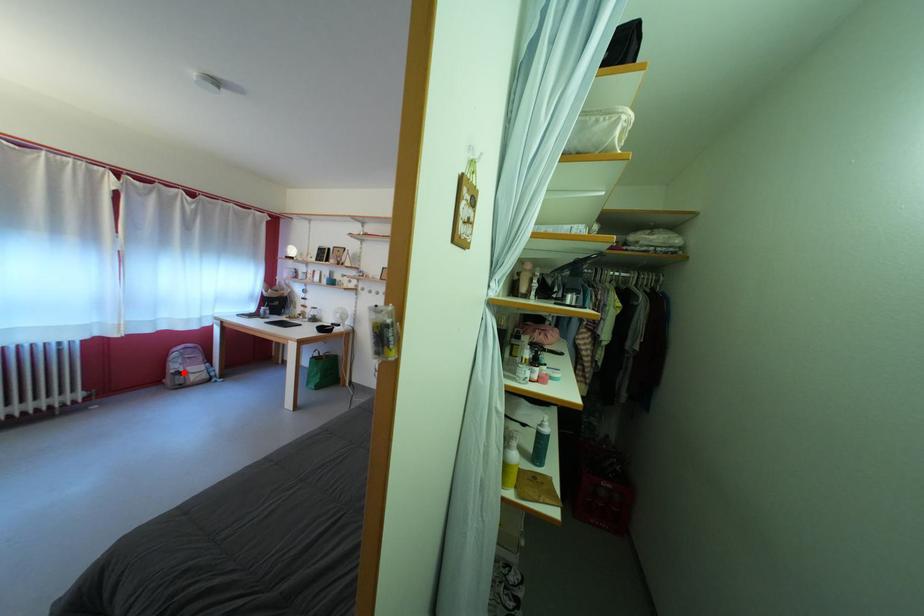
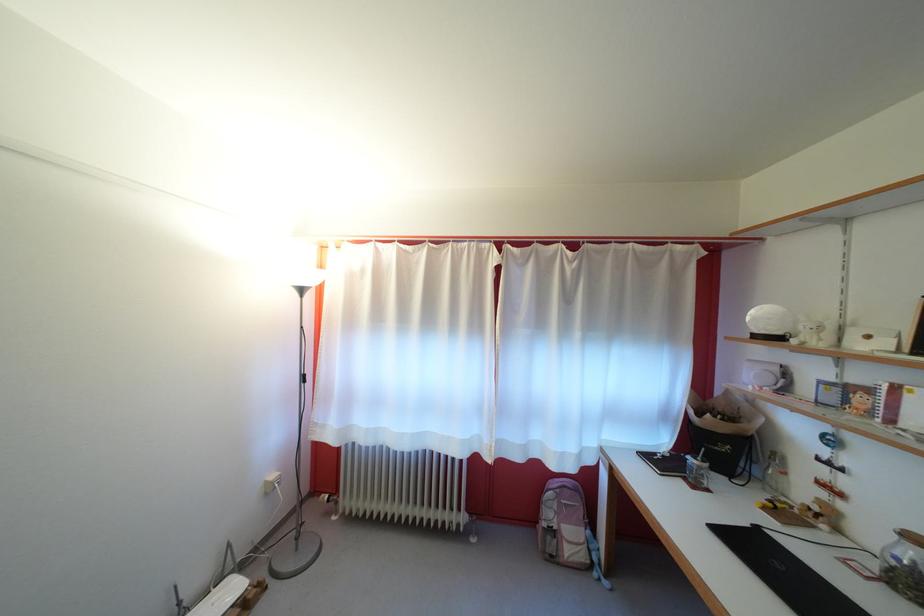
In the second image, find the point that corresponds to the highlighted location in the first image.

(556, 521)